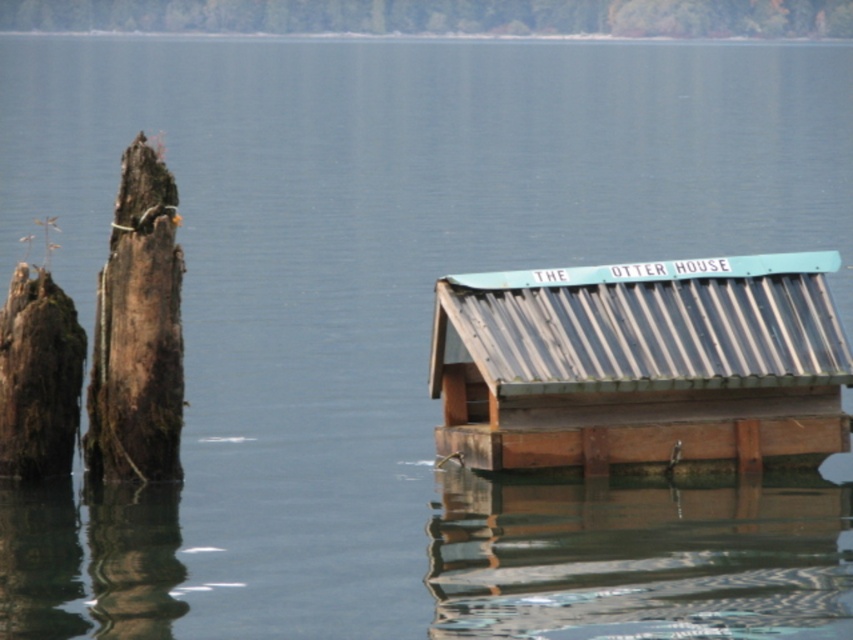
Question: Does dark brown wood at left appear under brown rough tree trunk at left?

Choices:
 (A) yes
 (B) no

Answer: (B)

Question: Which of the following is the farthest from the observer?

Choices:
 (A) (4, 449)
 (B) (753, 256)
 (C) (119, 198)

Answer: (B)

Question: Which point appears closest to the camera in this image?

Choices:
 (A) (524, 374)
 (B) (16, 465)

Answer: (A)

Question: Is dark brown wood at left to the left of brown rough tree trunk at left from the viewer's perspective?

Choices:
 (A) yes
 (B) no

Answer: (B)

Question: Considering the relative positions of dark brown wood at left and brown rough tree trunk at left in the image provided, where is dark brown wood at left located with respect to brown rough tree trunk at left?

Choices:
 (A) right
 (B) left

Answer: (A)

Question: Which object is closer to the camera taking this photo?

Choices:
 (A) brown rough tree trunk at left
 (B) dark brown wood at left
 (C) metallic corrugated roof at center

Answer: (B)